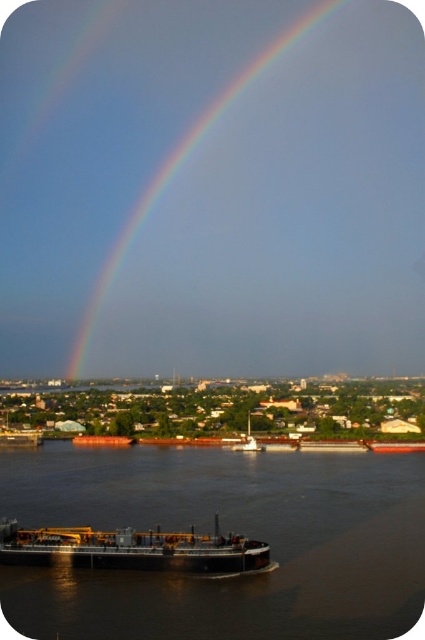
You are a drone operator trying to capture the rainbow at upper center from the black matte water at center. What is the approximate distance you need to cover to reach the rainbow from the water?

The distance between the black matte water at center and the rainbow at upper center is 246.46 meters, so you need to cover approximately 246.46 meters to reach the rainbow from the water.

You are standing on the shore and looking at the black matte water at center and the rainbow at upper center. Which object is closer to the ground?

The black matte water at center is closer to the ground than the rainbow at upper center because it is not as tall as the rainbow.

You are standing at the edge of the water and see two points on the water surface. The first point is at coordinates point (101, 524) and the second is at point (189, 570). Which point is closer to your current position?

Point (101, 524) is further to the viewer than point (189, 570), so the second point is closer to your current position.